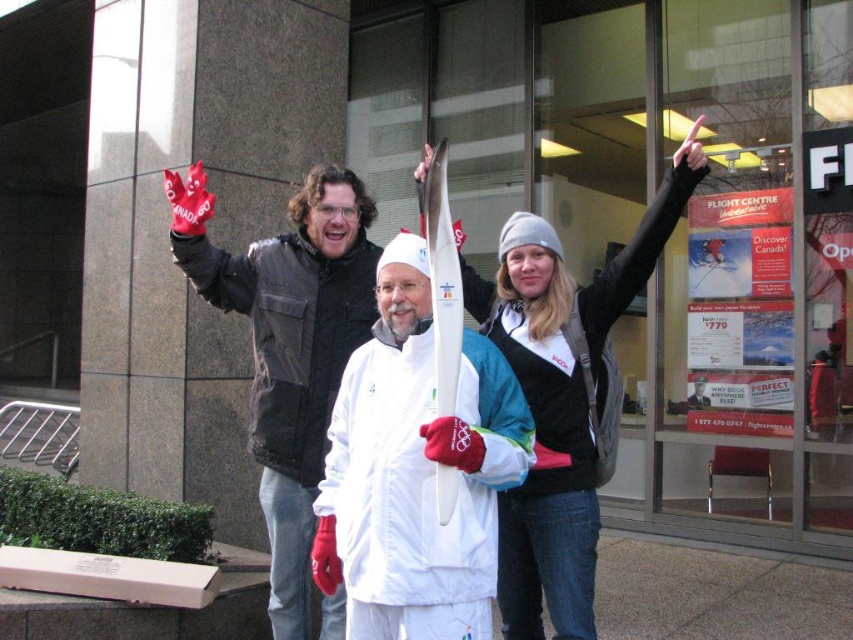
Can you confirm if white matte ski at center is positioned below white woolen hat at upper center?

Correct, white matte ski at center is located below white woolen hat at upper center.

Is point (368, 588) behind point (554, 577)?

No, (368, 588) is closer to viewer.

Locate an element on the screen. The image size is (853, 640). white matte ski at center is located at coordinates (416, 470).

Who is taller, white matte ski at center or matte black jacket at left?

matte black jacket at left

Does white matte ski at center have a lesser width compared to matte black jacket at left?

Indeed, white matte ski at center has a lesser width compared to matte black jacket at left.

Image resolution: width=853 pixels, height=640 pixels. What do you see at coordinates (416, 470) in the screenshot? I see `white matte ski at center` at bounding box center [416, 470].

You are a GUI agent. You are given a task and a screenshot of the screen. Output one action in this format:
    pyautogui.click(x=<x>, y=<y>)
    Task: Click on the white matte ski at center
    
    Given the screenshot: What is the action you would take?
    pyautogui.click(x=416, y=470)

Between white woolen hat at upper center and matte black jacket at left, which one has less height?

white woolen hat at upper center

Is white woolen hat at upper center closer to camera compared to matte black jacket at left?

That is True.

This screenshot has height=640, width=853. Describe the element at coordinates (564, 397) in the screenshot. I see `white woolen hat at upper center` at that location.

Identify the location of white woolen hat at upper center. pos(564,397).